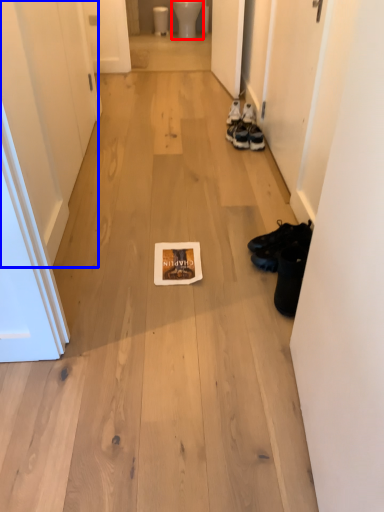
Question: Which object is closer to the camera taking this photo, toilet bowl (highlighted by a red box) or door (highlighted by a blue box)?

Choices:
 (A) toilet bowl
 (B) door

Answer: (B)